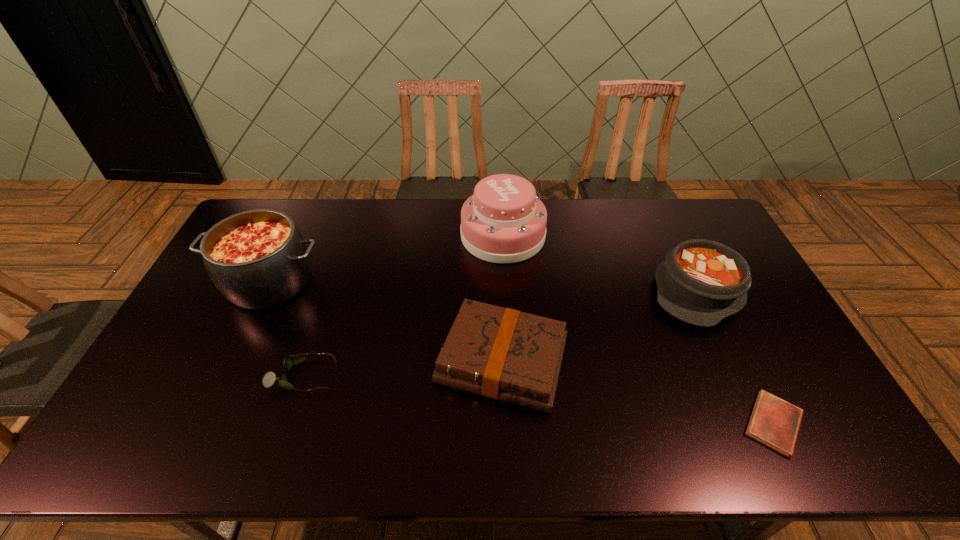
Locate an element on the screen. This screenshot has height=540, width=960. free space between the taller casserole and the fifth tallest object is located at coordinates (286, 329).

Find the location of `free space between the cake and the left casserole`. free space between the cake and the left casserole is located at coordinates pos(386,259).

Find the location of a particular element. object that can be found as the fifth closest to the cake is located at coordinates (774, 422).

Choose which object is the third nearest neighbor to the taller casserole. Please provide its 2D coordinates. Your answer should be formatted as a tuple, i.e. [(x, y)], where the tuple contains the x and y coordinates of a point satisfying the conditions above.

[(504, 221)]

Locate an element on the screen. The width and height of the screenshot is (960, 540). free space in the image that satisfies the following two spatial constraints: 1. on the back side of the taller casserole; 2. on the right side of the cake is located at coordinates (291, 235).

Where is `vacant point that satisfies the following two spatial constraints: 1. on the front-facing side of the spectacles; 2. on the right side of the diary`? Image resolution: width=960 pixels, height=540 pixels. vacant point that satisfies the following two spatial constraints: 1. on the front-facing side of the spectacles; 2. on the right side of the diary is located at coordinates (286, 424).

You are a GUI agent. You are given a task and a screenshot of the screen. Output one action in this format:
    pyautogui.click(x=<x>, y=<y>)
    Task: Click on the free space that satisfies the following two spatial constraints: 1. on the back side of the cake; 2. on the left side of the hardback book
    This screenshot has height=540, width=960.
    Given the screenshot: What is the action you would take?
    pyautogui.click(x=497, y=235)

Locate an element on the screen. blank area in the image that satisfies the following two spatial constraints: 1. on the back side of the diary; 2. on the front-facing side of the spectacles is located at coordinates (750, 376).

Find the location of `free location that satisfies the following two spatial constraints: 1. on the front side of the diary; 2. on the right side of the shorter casserole`. free location that satisfies the following two spatial constraints: 1. on the front side of the diary; 2. on the right side of the shorter casserole is located at coordinates (761, 424).

Locate an element on the screen. blank area in the image that satisfies the following two spatial constraints: 1. on the back side of the fourth tallest object; 2. on the left side of the cake is located at coordinates (497, 235).